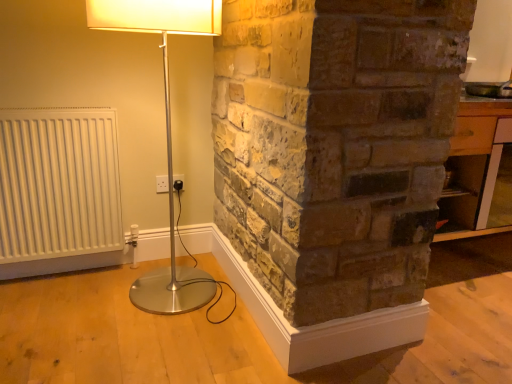
Question: Does white plastic electric outlet at center have a greater width compared to wooden table at right?

Choices:
 (A) yes
 (B) no

Answer: (B)

Question: Does white plastic electric outlet at center turn towards wooden table at right?

Choices:
 (A) yes
 (B) no

Answer: (B)

Question: Is the position of white plastic electric outlet at center less distant than that of wooden table at right?

Choices:
 (A) yes
 (B) no

Answer: (B)

Question: Is white plastic electric outlet at center shorter than wooden table at right?

Choices:
 (A) no
 (B) yes

Answer: (B)

Question: Is white plastic electric outlet at center not near wooden table at right?

Choices:
 (A) no
 (B) yes

Answer: (B)

Question: Based on their positions, is white plastic electric outlet at center located to the left or right of white matte radiator at left?

Choices:
 (A) left
 (B) right

Answer: (B)

Question: Based on their sizes in the image, would you say white plastic electric outlet at center is bigger or smaller than white matte radiator at left?

Choices:
 (A) small
 (B) big

Answer: (A)

Question: From their relative heights in the image, would you say white plastic electric outlet at center is taller or shorter than white matte radiator at left?

Choices:
 (A) short
 (B) tall

Answer: (A)

Question: In the image, is white plastic electric outlet at center positioned in front of or behind white matte radiator at left?

Choices:
 (A) front
 (B) behind

Answer: (B)

Question: Do you think white plastic electric outlet at center is within silver metallic floor lamp at left, or outside of it?

Choices:
 (A) inside
 (B) outside

Answer: (B)

Question: From their relative heights in the image, would you say white plastic electric outlet at center is taller or shorter than silver metallic floor lamp at left?

Choices:
 (A) short
 (B) tall

Answer: (A)

Question: From the image's perspective, relative to silver metallic floor lamp at left, is white plastic electric outlet at center above or below?

Choices:
 (A) below
 (B) above

Answer: (A)

Question: In the image, is white plastic electric outlet at center positioned in front of or behind silver metallic floor lamp at left?

Choices:
 (A) front
 (B) behind

Answer: (B)

Question: Is white matte radiator at left to the left or to the right of silver metallic floor lamp at left in the image?

Choices:
 (A) right
 (B) left

Answer: (B)

Question: Considering their positions, is white matte radiator at left located in front of or behind silver metallic floor lamp at left?

Choices:
 (A) front
 (B) behind

Answer: (B)